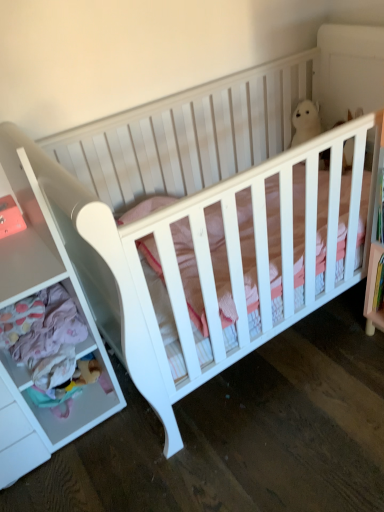
At what (x,y) coordinates should I click in order to perform the action: click on free spot to the right of soft plush bear at lower left. Please return your answer as a coordinate pair (x, y). Looking at the image, I should click on (122, 408).